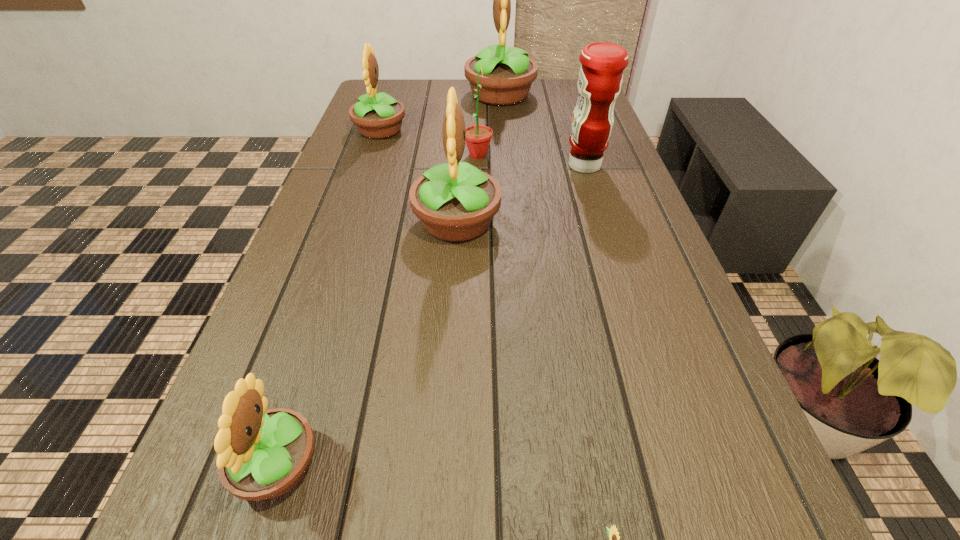
Identify the location of object located at the far edge. This screenshot has height=540, width=960. (508, 73).

In order to click on object that is at the right edge in this screenshot , I will do `click(600, 78)`.

The image size is (960, 540). In the image, there is a desktop. What are the coordinates of `free region at the left edge` in the screenshot? It's located at (321, 217).

Where is `free space at the right edge of the desktop`? This screenshot has height=540, width=960. free space at the right edge of the desktop is located at coordinates (556, 113).

The image size is (960, 540). In order to click on free spot at the far left corner of the desktop in this screenshot , I will do `click(407, 93)`.

The image size is (960, 540). I want to click on vacant point located between the second nearest sunflower and the farther green sunflower, so click(x=377, y=310).

This screenshot has width=960, height=540. Find the location of `empty space between the second nearest sunflower and the bigger green sunflower`. empty space between the second nearest sunflower and the bigger green sunflower is located at coordinates (377, 310).

The width and height of the screenshot is (960, 540). Find the location of `free space between the third smallest yellow sunflower and the sixth farthest object`. free space between the third smallest yellow sunflower and the sixth farthest object is located at coordinates (367, 344).

Locate an element on the screen. This screenshot has height=540, width=960. vacant area between the nearest yellow sunflower and the third farthest yellow sunflower is located at coordinates (367, 344).

Locate an element on the screen. This screenshot has height=540, width=960. vacant space that is in between the condiment and the smallest yellow sunflower is located at coordinates (431, 316).